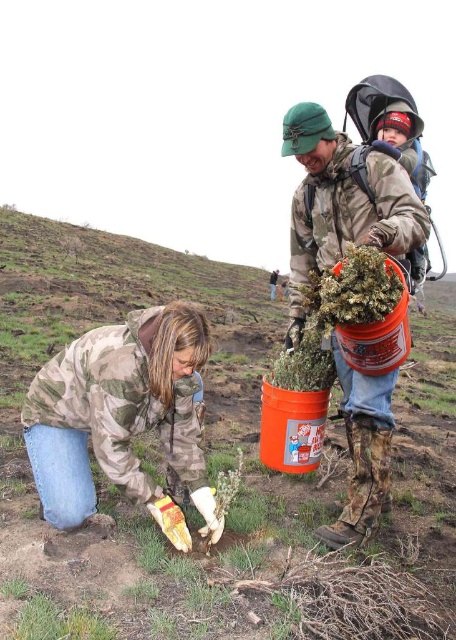
Does camouflage jacket at lower left appear over camouflage jacket at center?

Actually, camouflage jacket at lower left is below camouflage jacket at center.

Does camouflage jacket at lower left appear under camouflage jacket at center?

Indeed, camouflage jacket at lower left is positioned under camouflage jacket at center.

The height and width of the screenshot is (640, 456). In order to click on camouflage jacket at lower left in this screenshot , I will do `click(123, 419)`.